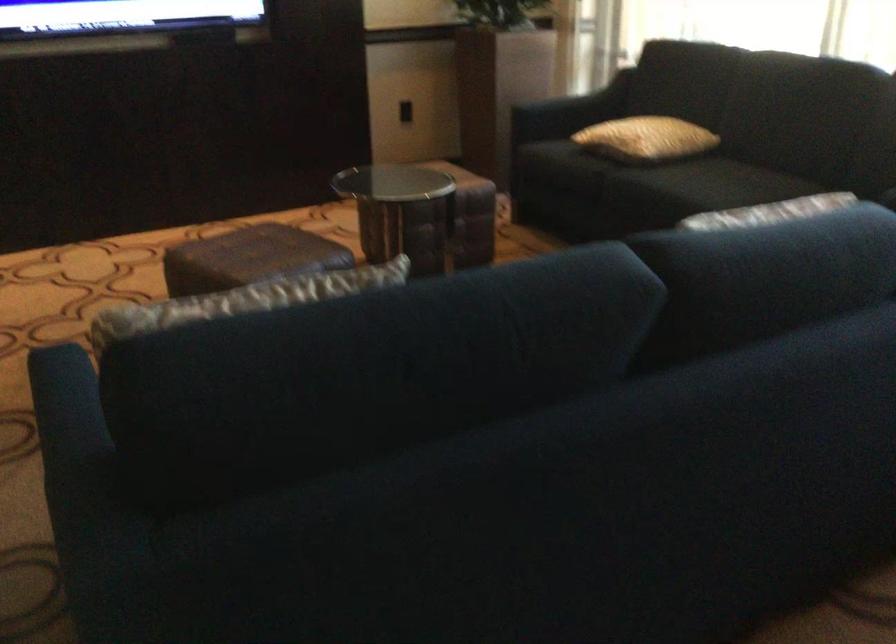
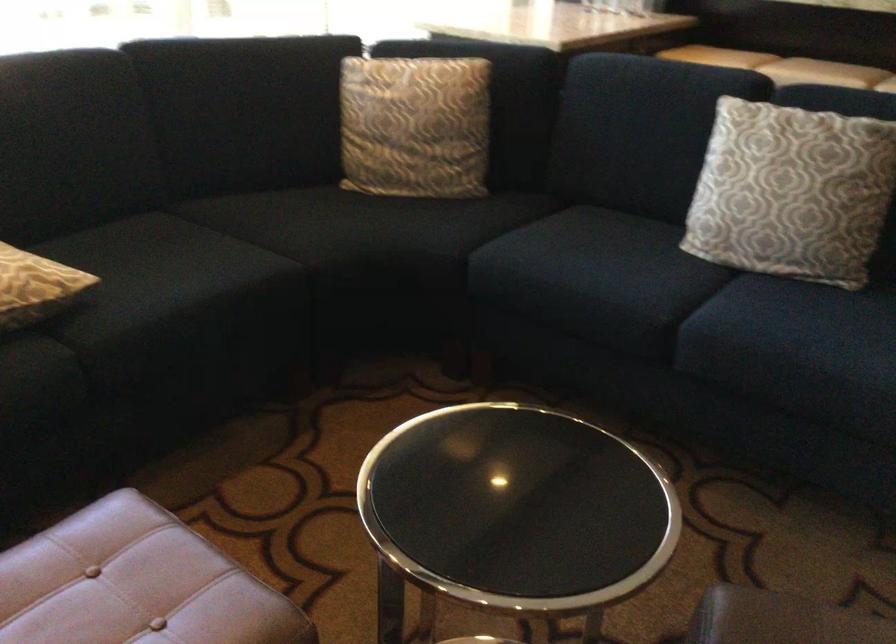
The point at (633, 142) is marked in the first image. Where is the corresponding point in the second image?

(35, 287)